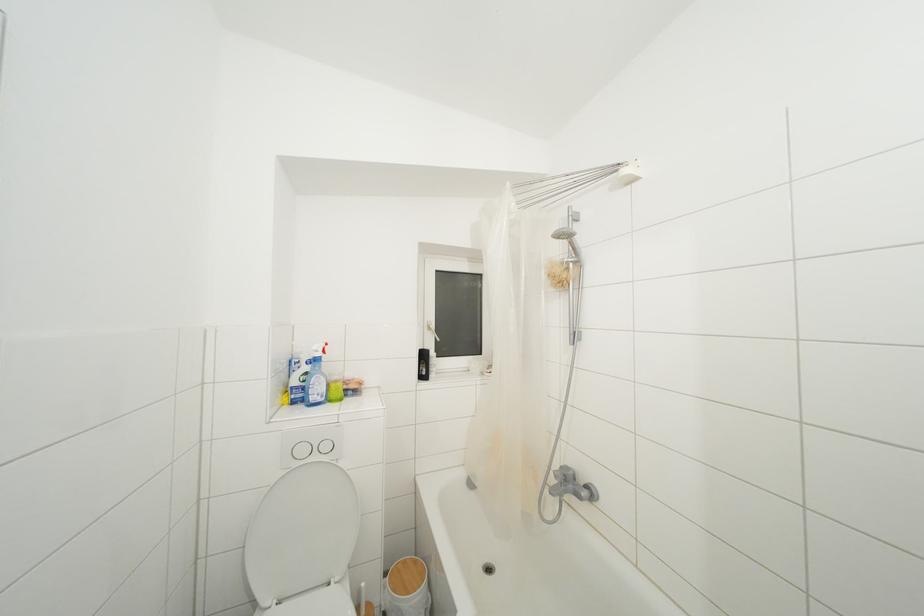
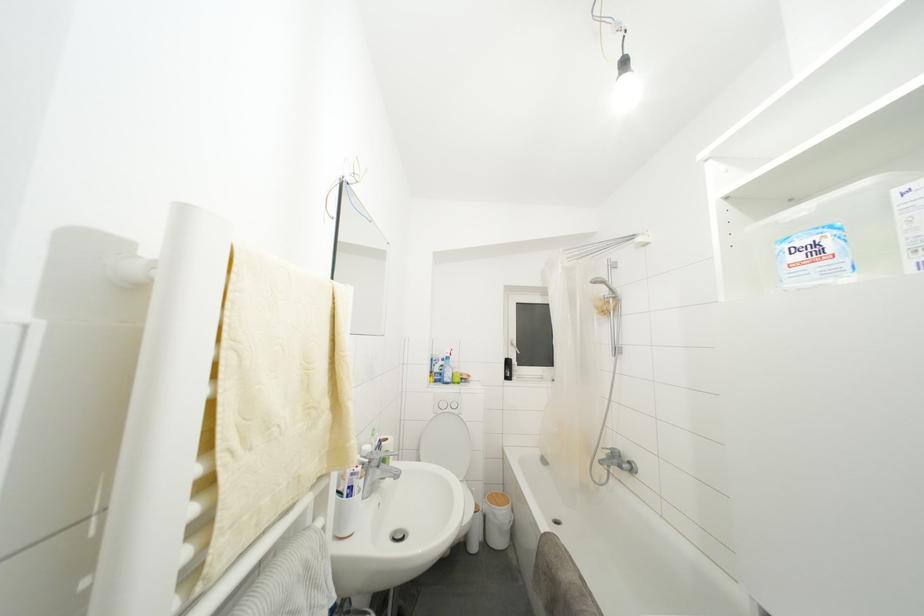
Question: The images are taken continuously from a first-person perspective. In which direction are you moving?

Choices:
 (A) Left
 (B) Right
 (C) Forward
 (D) Backward

Answer: (D)